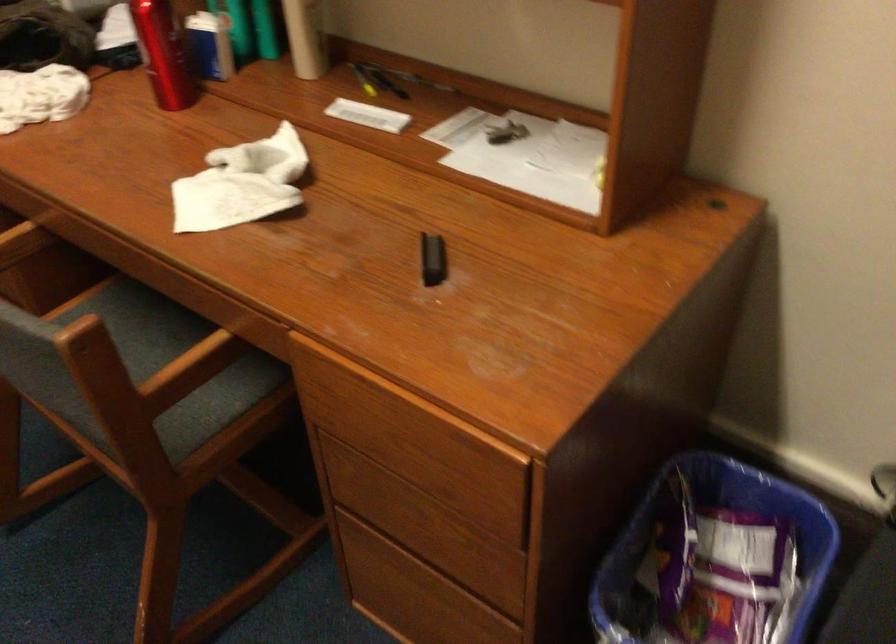
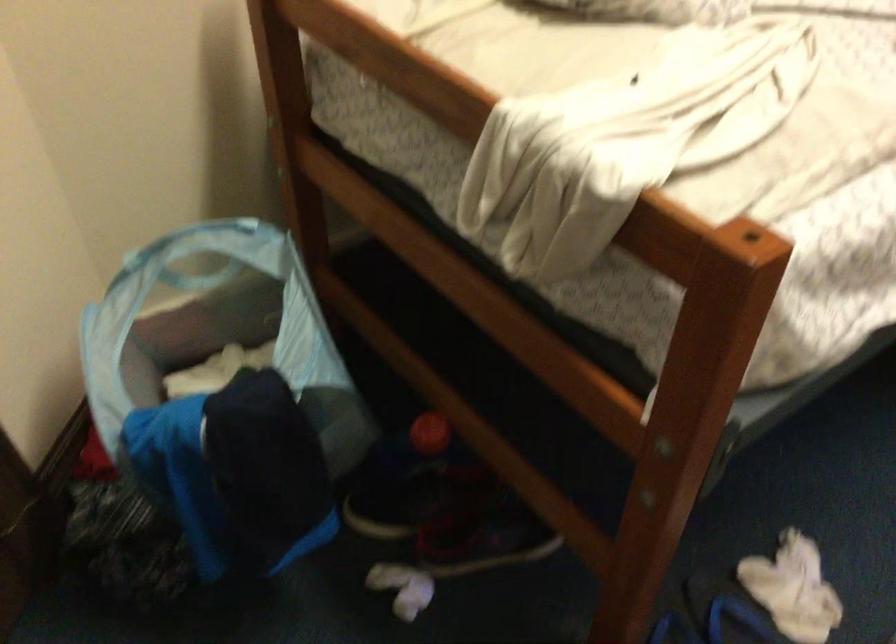
Consider the image. The images are taken continuously from a first-person perspective. In which direction is your viewpoint rotating?

The camera rotated toward left-down.